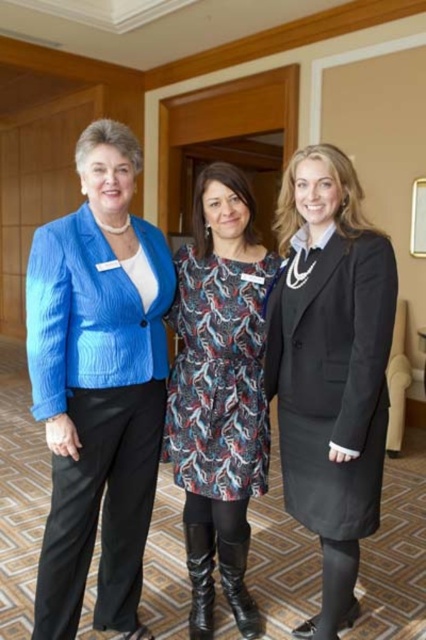
You are at a formal event and need to locate the person wearing the matte blue blazer at left and the matte black suit at center. From the perspective of someone standing in front of them, which person is positioned to the right?

The matte black suit at center is positioned to the right of the matte blue blazer at left, so the person wearing the matte black suit at center is to the right.

You are a photographer at the event and need to adjust the camera height to capture both the matte blue blazer at left and the printed fabric dress at center in the same frame. Which object should you focus on to ensure both are visible?

Since the matte blue blazer at left is taller than the printed fabric dress at center, you should focus on the matte blue blazer at left to ensure both are visible in the frame.

You are organizing a photo shoot and need to arrange the two outfits displayed in the image. The matte black suit at center and the printed fabric dress at center must be placed side by side on a rack. Given that the rack has limited horizontal space, which outfit should be placed first to ensure both fit properly?

The matte black suit at center has a lesser width compared to the printed fabric dress at center. Therefore, place the printed fabric dress at center first, as it is wider, followed by the matte black suit at center to utilize the space efficiently.